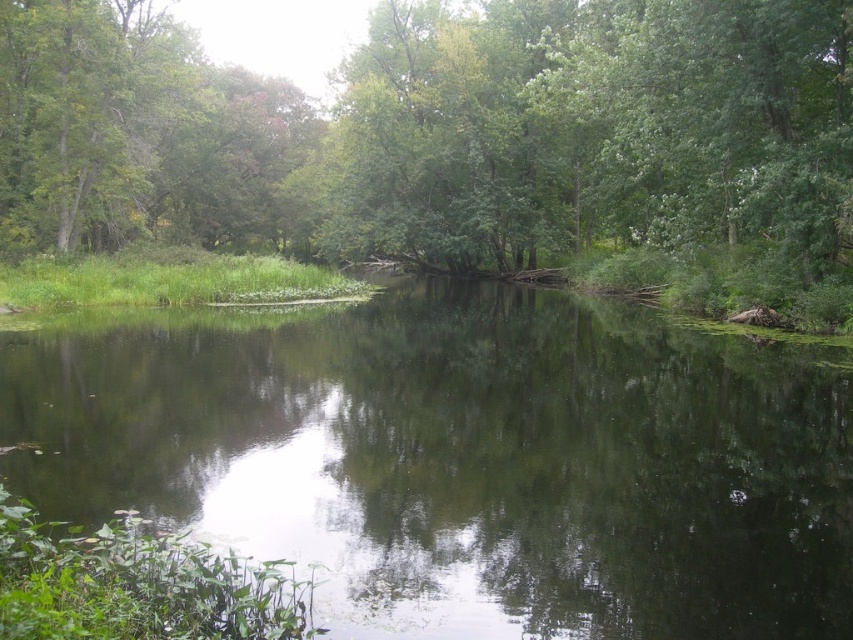
In the scene shown: You are standing at the edge of the pond and see the green reflective water at center and the green leafy tree at center. Which object is closer to you?

The green reflective water at center is closer to you because it is in front of the green leafy tree at center.

You are standing at the edge of the pond and notice the green reflective water at center and the green leafy tree at center. Which object is closer to you?

The green reflective water at center is closer to you because it is positioned under the green leafy tree at center, meaning the water is at a lower elevation and nearer to your viewpoint.